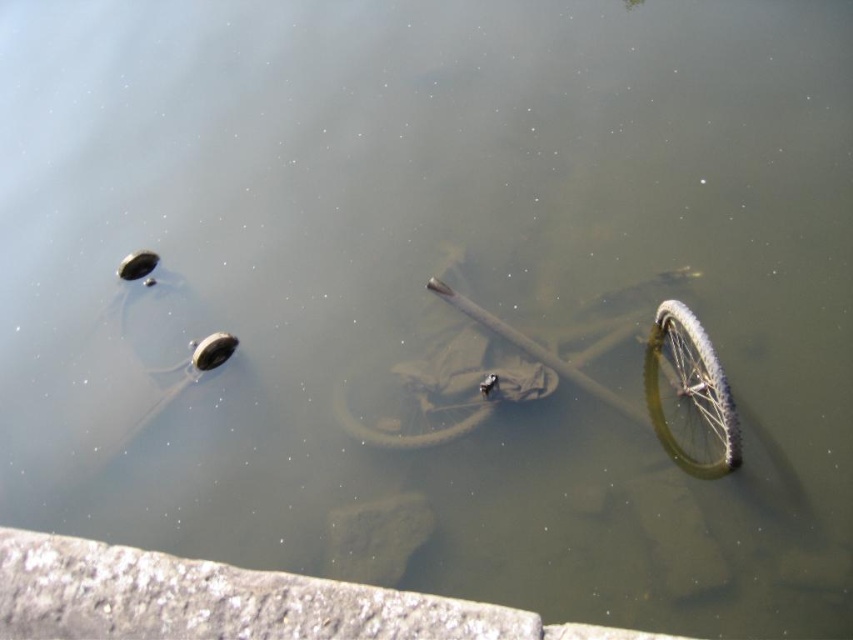
Between point (700, 385) and point (364, 435), which one is positioned in front?

Point (700, 385) is in front.

Who is shorter, green rubber tire at lower right or green rubber tire at center?

green rubber tire at center

Is point (648, 387) more distant than point (462, 422)?

Yes, point (648, 387) is farther from viewer.

Where is `green rubber tire at lower right`? This screenshot has width=853, height=640. green rubber tire at lower right is located at coordinates (691, 390).

Which of these two, green rubber bicycle at center or green rubber tire at center, stands shorter?

Standing shorter between the two is green rubber tire at center.

Is green rubber bicycle at center closer to the viewer compared to green rubber tire at center?

Yes, green rubber bicycle at center is in front of green rubber tire at center.

Which is behind, point (682, 444) or point (489, 416)?

Positioned behind is point (489, 416).

What are the coordinates of `green rubber bicycle at center` in the screenshot? It's located at (576, 381).

Does green rubber bicycle at center appear on the right side of green rubber tire at lower right?

Incorrect, green rubber bicycle at center is not on the right side of green rubber tire at lower right.

Between point (517, 390) and point (735, 432), which one is positioned in front?

Point (735, 432) is more forward.

Where is `green rubber bicycle at center`? green rubber bicycle at center is located at coordinates (576, 381).

The height and width of the screenshot is (640, 853). Find the location of `green rubber bicycle at center`. green rubber bicycle at center is located at coordinates (576, 381).